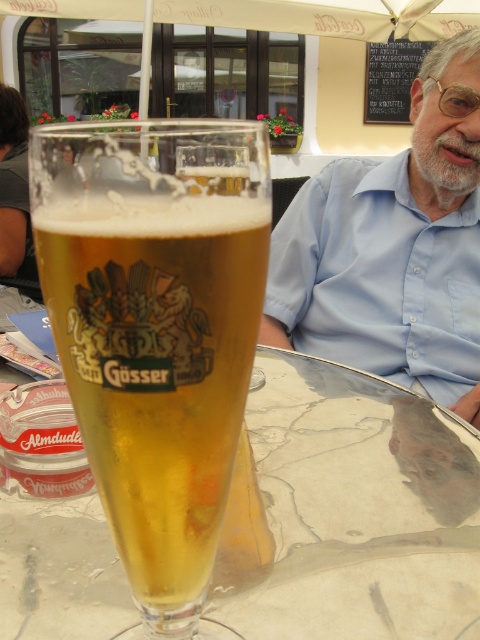
You are at the outdoor cafe and want to place a small napkin between the two points on the table. Which point should you start placing the napkin closer to the camera? The points are point (232, 384) and point (262, 628).

You should start placing the napkin closer to point (232, 384) because it is closer to the camera than point (262, 628).

You are a waiter at the outdoor cafe and need to deliver a napkin to the customer. The napkin is currently on the counter behind you. You can either walk around the table to the left or the right. Considering the distance between the translucent glass beer at center and the blue cotton shirt at upper center, which side would allow you to reach the customer without knocking over the beer?

Since the translucent glass beer at center and the blue cotton shirt at upper center are 24.34 inches apart, you should choose the side that provides more space. Walking around the right side of the table would likely be safer to avoid knocking over the beer.